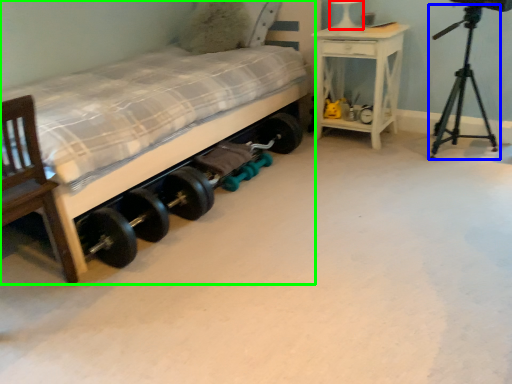
Question: Based on their relative distances, which object is nearer to table lamp (highlighted by a red box)? Choose from tripod (highlighted by a blue box) and bed (highlighted by a green box).

Choices:
 (A) tripod
 (B) bed

Answer: (A)